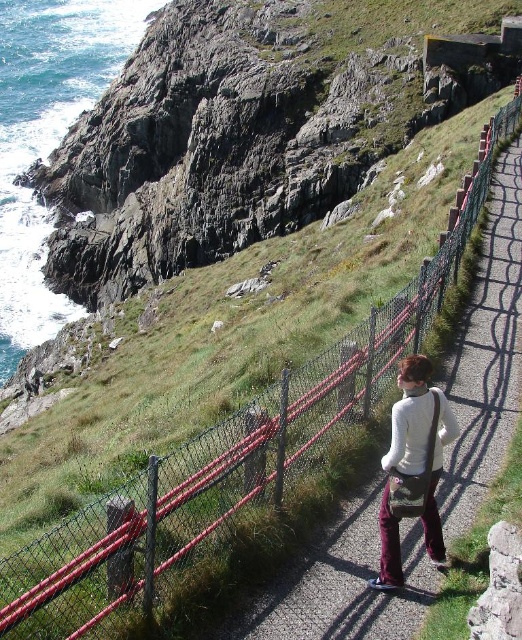
You are standing on the coastal path and see the green grassy hillside at upper left and the white matte sweater at center. Which object is farther away from you?

The green grassy hillside at upper left is farther away from you than the white matte sweater at center because it is 49.28 meters away.

You are standing on the coastal path and want to walk from the point at coordinates point (375,51) to the point at coordinates point (405,360). Which direction should you face to move towards the destination?

You should face away from the cliff edge because point (375,51) is closer to you than point (405,360), so moving away from the cliff edge will take you towards the destination.

Based on the scene description, what is located at the coordinate point (246, 129)?

The green grassy hillside at upper left is located at point (246, 129).